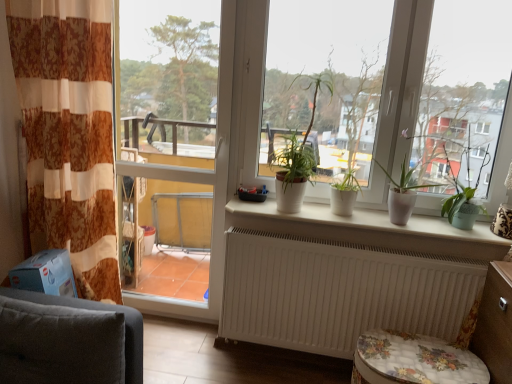
Identify the location of vacant space situated above floral fabric music stool at lower right (from a real-world perspective). (418, 356).